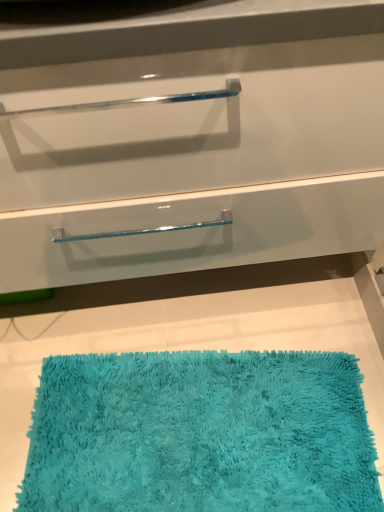
This screenshot has width=384, height=512. I want to click on empty space that is ontop of turquoise shaggy bath mat at lower center, so click(x=198, y=426).